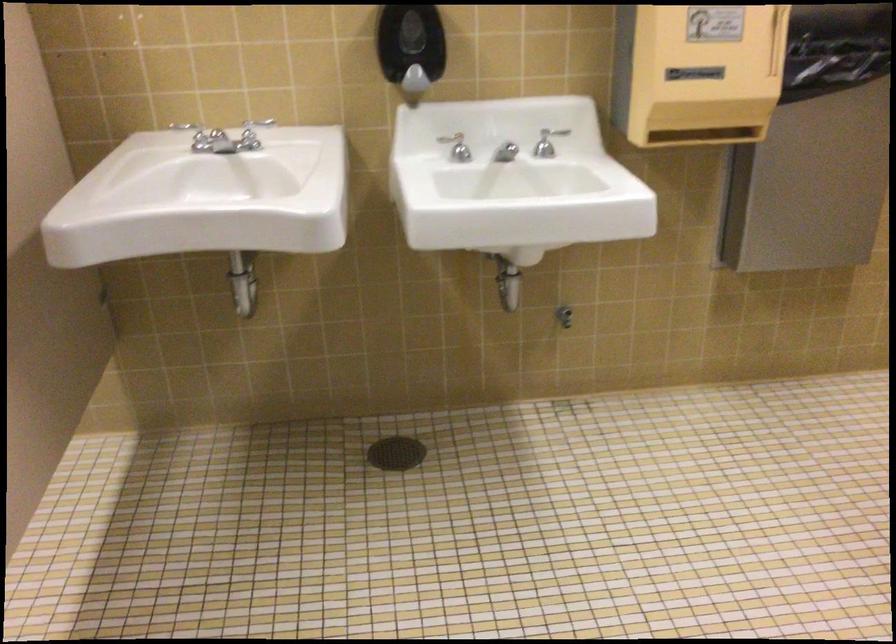
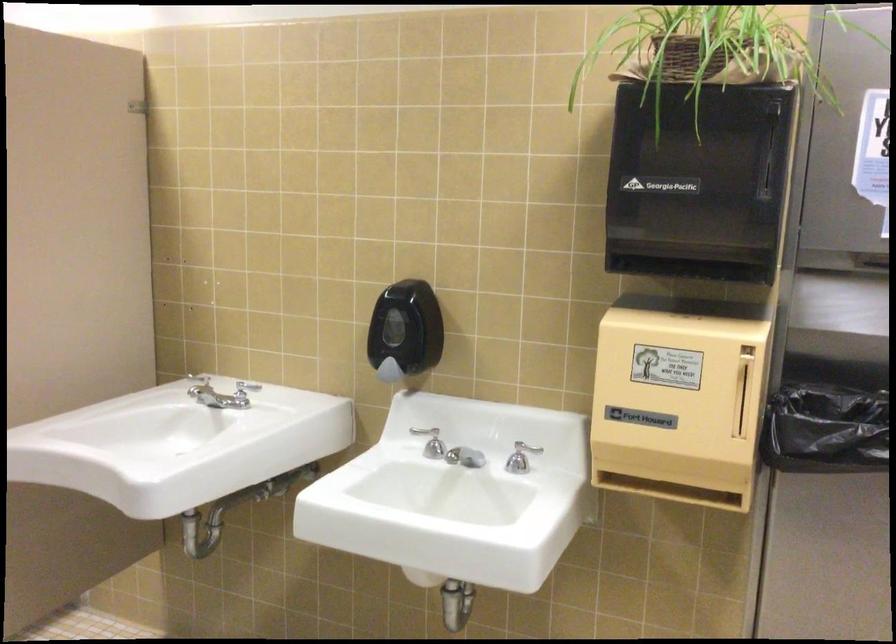
Locate, in the second image, the point that corresponds to (x=416, y=80) in the first image.

(389, 371)